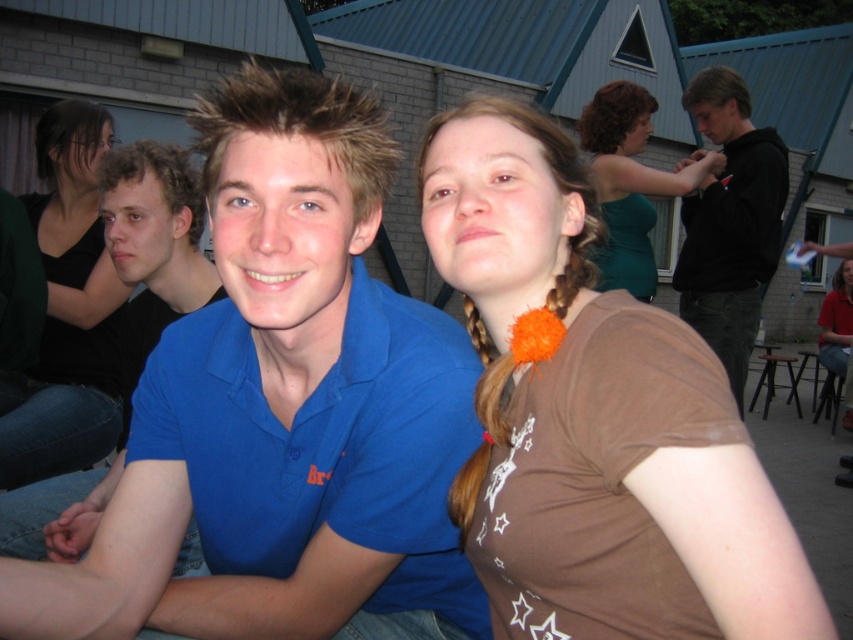
Question: Does blue cotton shirt at center appear under green satin dress at upper center?

Choices:
 (A) no
 (B) yes

Answer: (B)

Question: Which object is the farthest from the orange fuzzy ball at center?

Choices:
 (A) blue cotton shirt at center
 (B) brown fabric shirt at center

Answer: (A)

Question: Does brown fabric shirt at center come behind matte black shirt at upper left?

Choices:
 (A) no
 (B) yes

Answer: (A)

Question: Is blue cotton shirt at center positioned behind orange fuzzy ball at center?

Choices:
 (A) yes
 (B) no

Answer: (A)

Question: Which object is positioned closest to the black hoodie at right?

Choices:
 (A) green satin dress at upper center
 (B) blue cotton shirt at center
 (C) matte black shirt at upper left
 (D) brown fabric shirt at center

Answer: (A)

Question: Which point appears farthest from the camera in this image?

Choices:
 (A) (602, 115)
 (B) (12, 602)

Answer: (A)